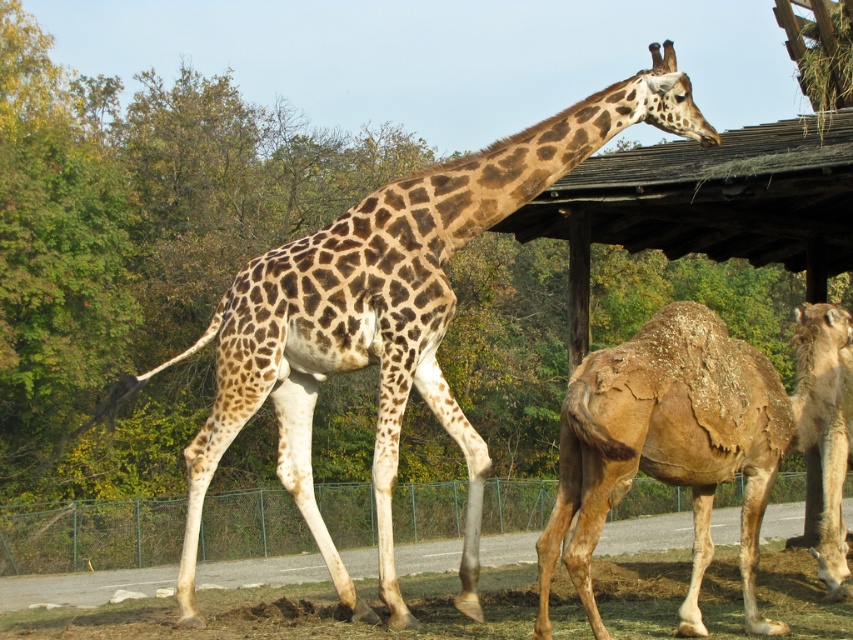
You are a zookeeper who needs to feed the animals. You have a bucket of food and are standing at the front of the enclosure. The spotted fur giraffe at center is your first priority. Which direction should you move to reach it first without disturbing the brown textured camel at right?

The spotted fur giraffe at center is below the brown textured camel at right, so you should move forward towards the center of the enclosure to reach the spotted fur giraffe at center first without disturbing the camel.

You are a zookeeper planning to place a new feeding station in the enclosure. The feeding station requires a space larger than the area occupied by the spotted fur giraffe at center. Can the brown textured camel at right be used to determine if the space is sufficient?

The spotted fur giraffe at center occupies less space than the brown textured camel at right. Therefore, if the feeding station requires more space than the giraffe, the area occupied by the brown textured camel at right would be sufficient since it is larger.

From the picture: You are a zookeeper planning to feed the animals. You see the spotted fur giraffe at center and the metallic wire fence at lower center. Which animal is closer to the fence?

The spotted fur giraffe at center is to the left of the metallic wire fence at lower center, so the giraffe is closer to the fence than the camel.